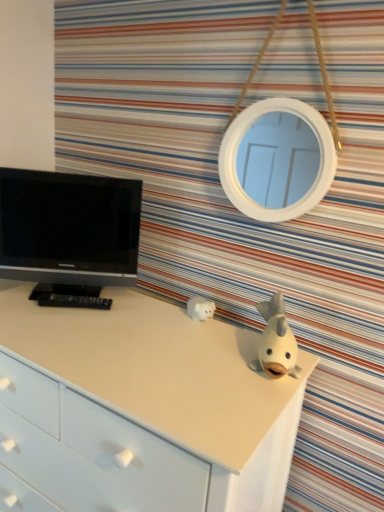
Question: Looking at the image, does black glossy tv at left seem bigger or smaller compared to white matte piggy bank at center, the first toy from the back?

Choices:
 (A) big
 (B) small

Answer: (A)

Question: Considering the positions of black glossy tv at left and white matte piggy bank at center, which is counted as the first toy, starting from the left, in the image, is black glossy tv at left taller or shorter than white matte piggy bank at center, which is counted as the first toy, starting from the left,?

Choices:
 (A) tall
 (B) short

Answer: (A)

Question: Which of these objects is positioned farthest from the black glossy tv at left?

Choices:
 (A) white matte fish at upper right, the 2th toy viewed from the left
 (B) white matte piggy bank at center, which is counted as the first toy, starting from the left
 (C) white matte chest of drawers at center

Answer: (A)

Question: Which is nearer to the white matte piggy bank at center, the second toy from the right?

Choices:
 (A) white matte chest of drawers at center
 (B) black glossy tv at left
 (C) white matte fish at upper right, arranged as the first toy when viewed from the front

Answer: (C)